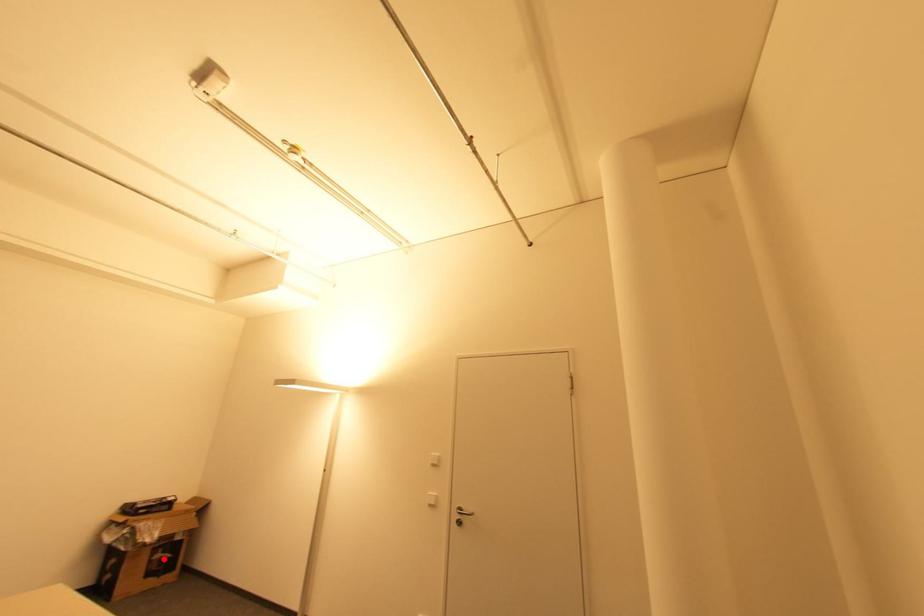
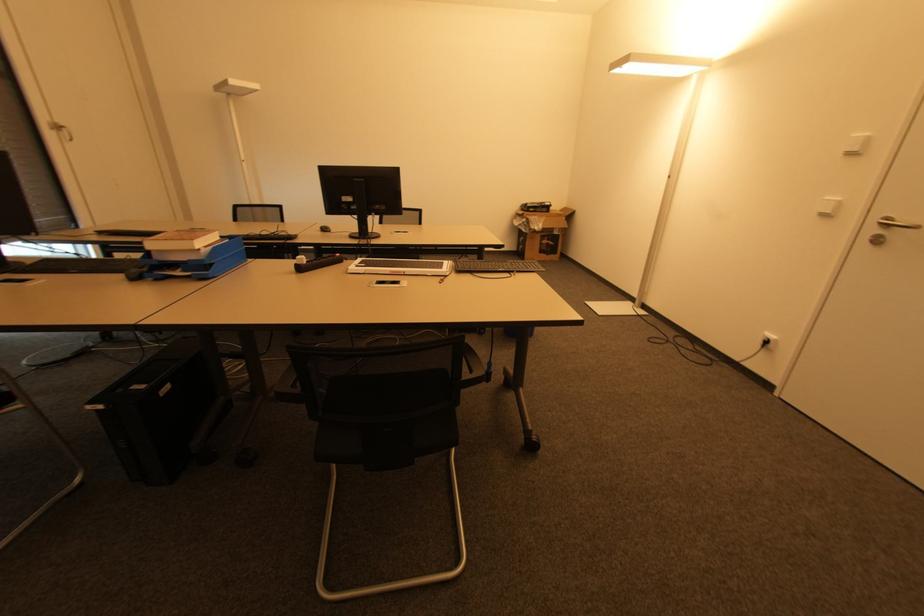
Where in the second image is the point corresponding to the highlighted location from the first image?

(550, 245)